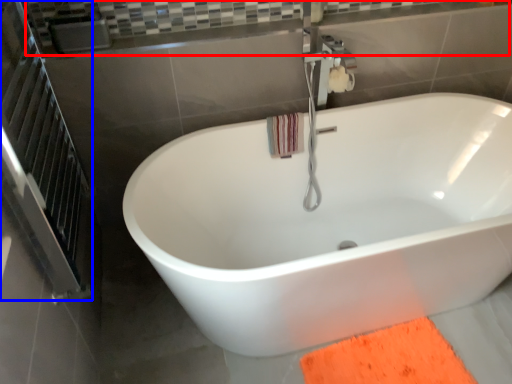
Question: Which object appears closest to the camera in this image, balustrade (highlighted by a red box) or screen door (highlighted by a blue box)?

Choices:
 (A) balustrade
 (B) screen door

Answer: (B)